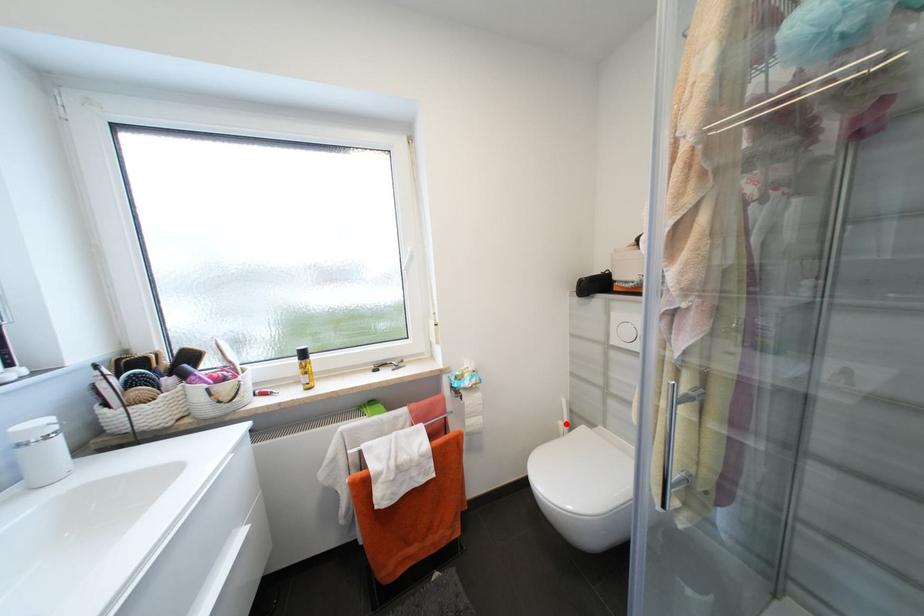
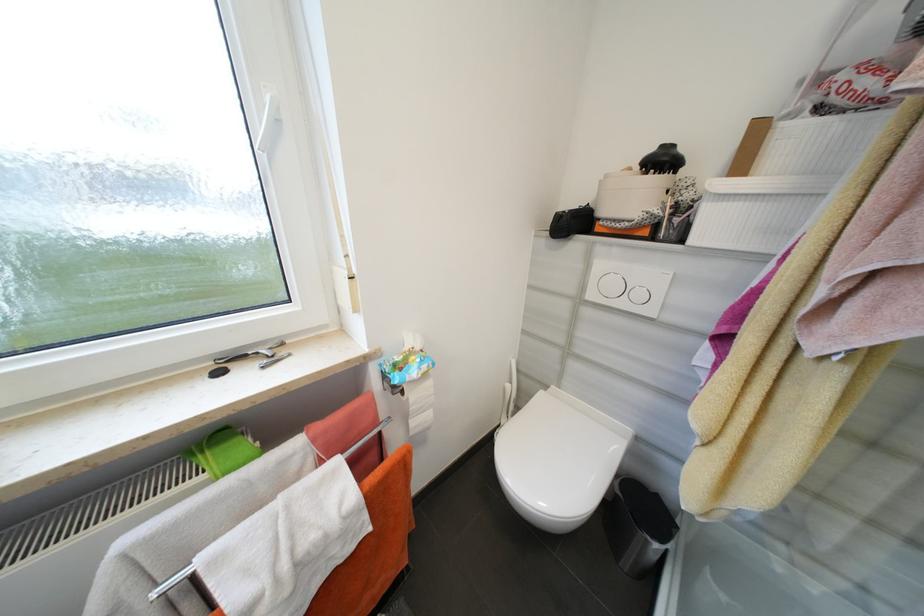
In the second image, find the point that corresponds to the highlighted location in the first image.

(514, 387)